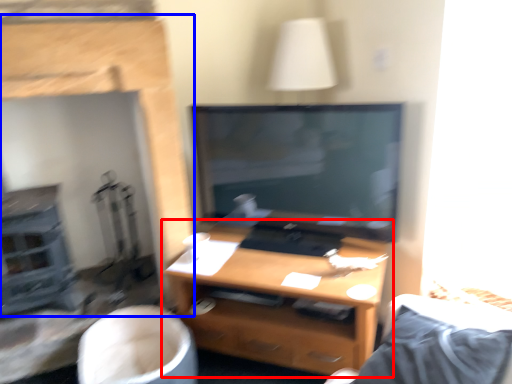
Question: Which point is closer to the camera, desk (highlighted by a red box) or fireplace (highlighted by a blue box)?

Choices:
 (A) desk
 (B) fireplace

Answer: (B)